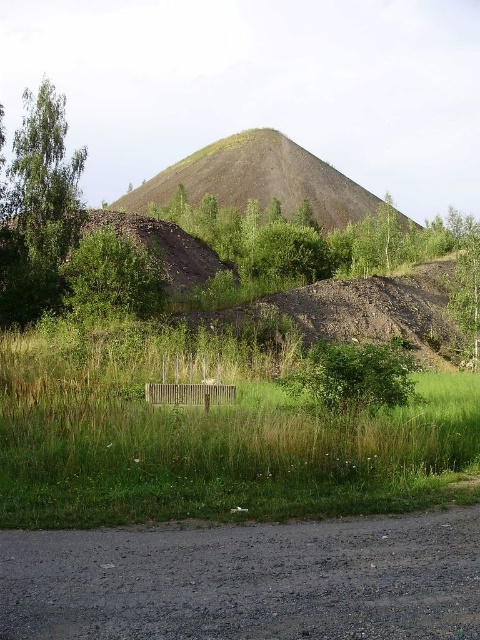
Is the position of green leafy tree at left more distant than that of green leafy tree at upper right?

Yes, it is behind green leafy tree at upper right.

Is green leafy tree at left positioned before green leafy tree at upper right?

No, it is not.

Measure the distance between point (61, 161) and camera.

→ The distance of point (61, 161) from camera is 36.15 meters.

The width and height of the screenshot is (480, 640). In order to click on green leafy tree at left in this screenshot , I will do `click(37, 209)`.

From the picture: Can you confirm if brown gravel hill at center is bigger than green leafy tree at upper right?

Yes, brown gravel hill at center is bigger than green leafy tree at upper right.

Does point (144, 198) come closer to viewer compared to point (467, 230)?

No.

Between point (182, 168) and point (459, 305), which one is positioned in front?

Point (459, 305)

Where is `brown gravel hill at center`? This screenshot has width=480, height=640. brown gravel hill at center is located at coordinates (257, 179).

Can you confirm if gray gravel road at lower center is positioned to the left of green leafy tree at upper right?

Correct, you'll find gray gravel road at lower center to the left of green leafy tree at upper right.

Does gray gravel road at lower center appear on the right side of green leafy tree at upper right?

No, gray gravel road at lower center is not to the right of green leafy tree at upper right.

Which is in front, point (12, 556) or point (452, 289)?

Point (12, 556) is in front.

Locate an element on the screen. gray gravel road at lower center is located at coordinates (247, 580).